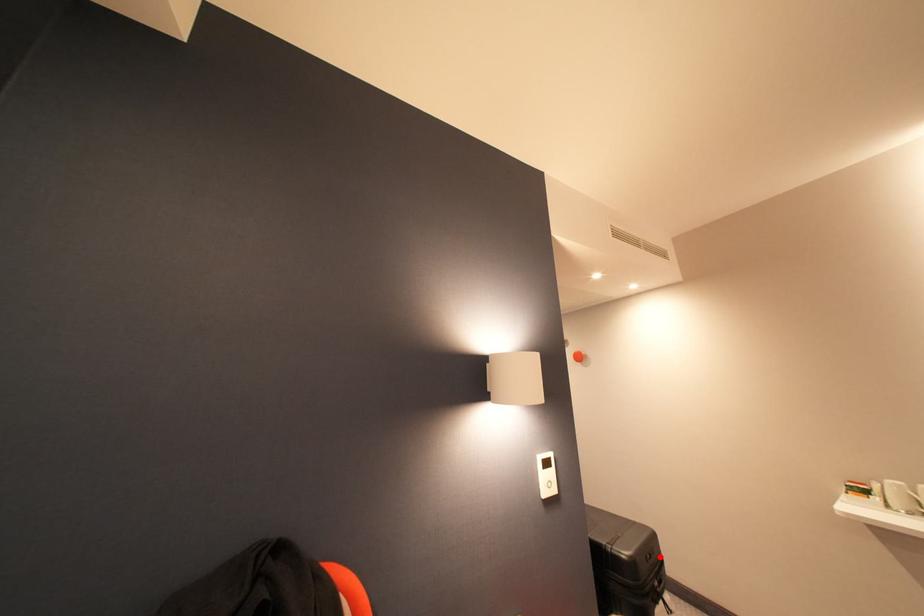
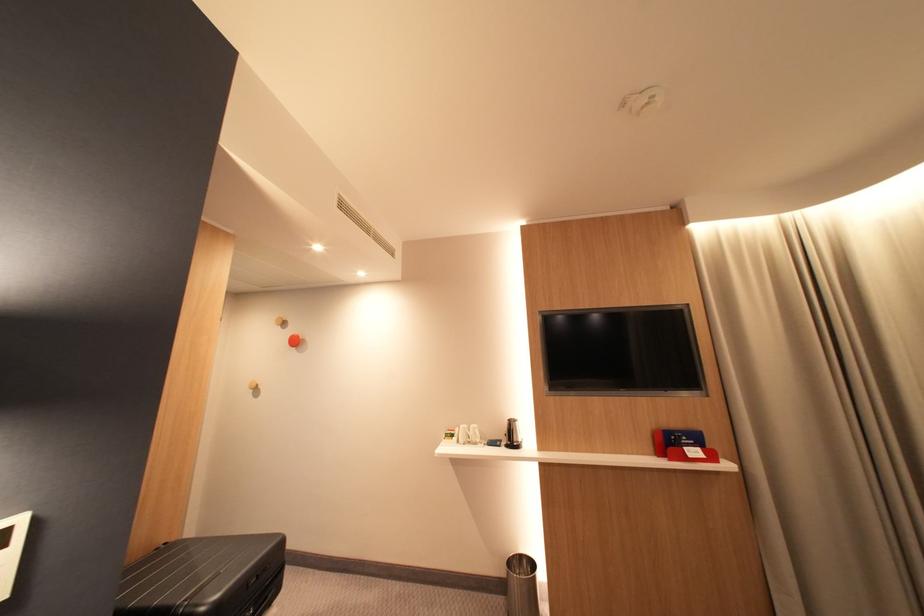
Locate, in the second image, the point that corresponds to the highlighted location in the first image.

(266, 578)